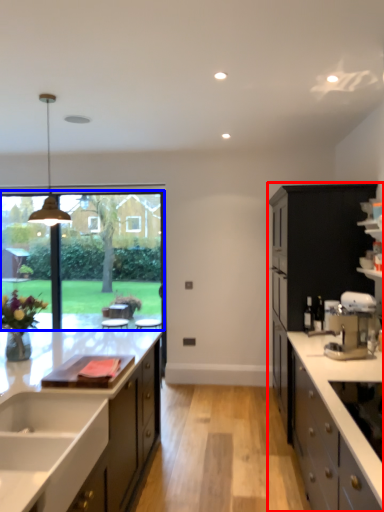
Question: Among these objects, which one is nearest to the camera, cabinetry (highlighted by a red box) or window screen (highlighted by a blue box)?

Choices:
 (A) cabinetry
 (B) window screen

Answer: (A)